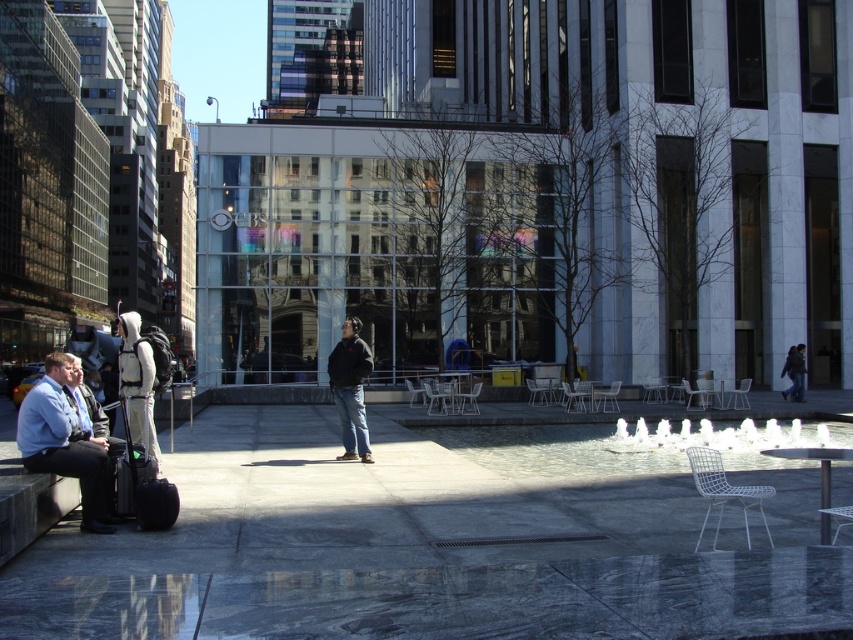
This screenshot has width=853, height=640. What do you see at coordinates (723, 435) in the screenshot? I see `white frothy water at lower right` at bounding box center [723, 435].

Between white frothy water at lower right and black matte suitcase at lower left, which one appears on the right side from the viewer's perspective?

white frothy water at lower right is more to the right.

Between point (741, 419) and point (144, 468), which one is positioned in front?

Point (144, 468) is in front.

You are a GUI agent. You are given a task and a screenshot of the screen. Output one action in this format:
    pyautogui.click(x=<x>, y=<y>)
    Task: Click on the white frothy water at lower right
    The image size is (853, 640).
    Given the screenshot: What is the action you would take?
    click(723, 435)

Is light blue shirt at lower left to the left of dark gray jacket at center from the viewer's perspective?

Yes, light blue shirt at lower left is to the left of dark gray jacket at center.

Is light blue shirt at lower left taller than dark gray jacket at center?

No, light blue shirt at lower left is not taller than dark gray jacket at center.

What do you see at coordinates (65, 444) in the screenshot? Image resolution: width=853 pixels, height=640 pixels. I see `light blue shirt at lower left` at bounding box center [65, 444].

What are the coordinates of `light blue shirt at lower left` in the screenshot? It's located at (65, 444).

This screenshot has width=853, height=640. Find the location of `dark blue jeans at center`. dark blue jeans at center is located at coordinates (350, 388).

Between dark blue jeans at center and black matte suitcase at lower left, which one is positioned higher?

dark blue jeans at center is higher up.

Describe the element at coordinates (350, 388) in the screenshot. I see `dark blue jeans at center` at that location.

This screenshot has height=640, width=853. I want to click on dark blue jeans at center, so click(x=350, y=388).